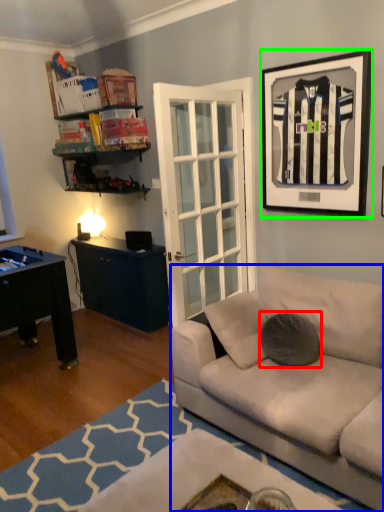
Question: Estimate the real-world distances between objects in this image. Which object is closer to pillow (highlighted by a red box), studio couch (highlighted by a blue box) or picture frame (highlighted by a green box)?

Choices:
 (A) studio couch
 (B) picture frame

Answer: (A)